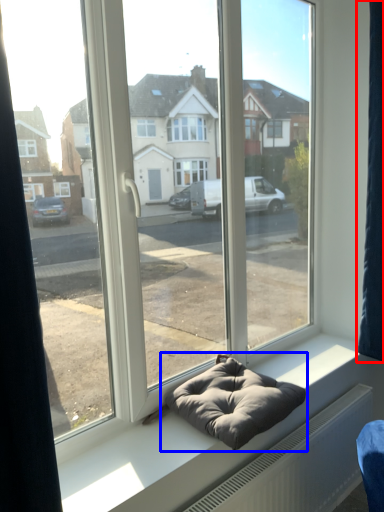
Question: Among these objects, which one is farthest to the camera, curtain (highlighted by a red box) or bean bag chair (highlighted by a blue box)?

Choices:
 (A) curtain
 (B) bean bag chair

Answer: (A)